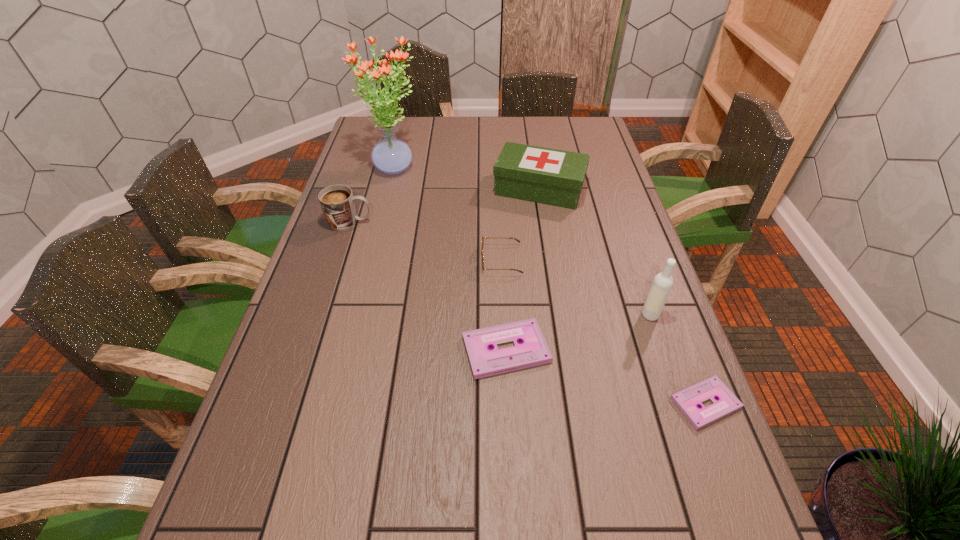
The height and width of the screenshot is (540, 960). Find the location of `blank region between the first-aid kit and the left videotape`. blank region between the first-aid kit and the left videotape is located at coordinates (522, 269).

Where is `free spot between the fifth tallest object and the first-aid kit`? The height and width of the screenshot is (540, 960). free spot between the fifth tallest object and the first-aid kit is located at coordinates 520,225.

This screenshot has width=960, height=540. I want to click on vacant area between the first-aid kit and the right videotape, so click(622, 296).

Find the location of `vacant space that's between the second tallest object and the left videotape`. vacant space that's between the second tallest object and the left videotape is located at coordinates (578, 332).

Find the location of `empty space that is in between the mug and the fifth tallest object`. empty space that is in between the mug and the fifth tallest object is located at coordinates (425, 241).

At what (x,y) coordinates should I click in order to perform the action: click on vacant space that is in between the sunglasses and the sixth tallest object. Please return your answer as a coordinate pair (x, y). The image size is (960, 540). Looking at the image, I should click on (504, 305).

Find the location of a particular element. The width and height of the screenshot is (960, 540). unoccupied area between the sixth tallest object and the tallest object is located at coordinates (449, 259).

This screenshot has height=540, width=960. I want to click on vacant area that lies between the first-aid kit and the left videotape, so click(522, 269).

You are a GUI agent. You are given a task and a screenshot of the screen. Output one action in this format:
    pyautogui.click(x=<x>, y=<y>)
    Task: Click on the vacant region between the taller videotape and the second tallest object
    
    Given the screenshot: What is the action you would take?
    pyautogui.click(x=578, y=332)

Identify which object is the sixth nearest to the shorter videotape. Please provide its 2D coordinates. Your answer should be formatted as a tuple, i.e. [(x, y)], where the tuple contains the x and y coordinates of a point satisfying the conditions above.

[(391, 155)]